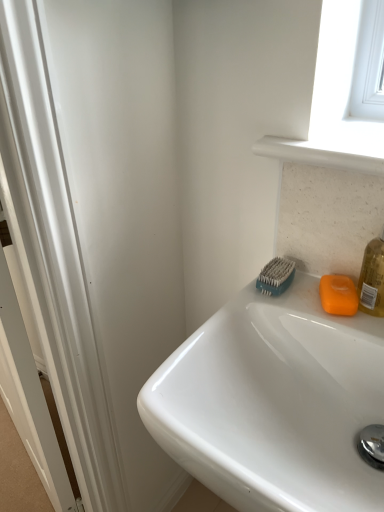
Question: From the image's perspective, is teal rubber brush at upper right positioned above or below white glossy sink at upper right?

Choices:
 (A) above
 (B) below

Answer: (A)

Question: Is teal rubber brush at upper right taller or shorter than white glossy sink at upper right?

Choices:
 (A) short
 (B) tall

Answer: (A)

Question: Estimate the real-world distances between objects in this image. Which object is farther from the teal rubber brush at upper right?

Choices:
 (A) orange matte soap at right
 (B) white glossy sink at upper right

Answer: (B)

Question: Which is nearer to the orange matte soap at right?

Choices:
 (A) teal rubber brush at upper right
 (B) white glossy sink at upper right

Answer: (A)